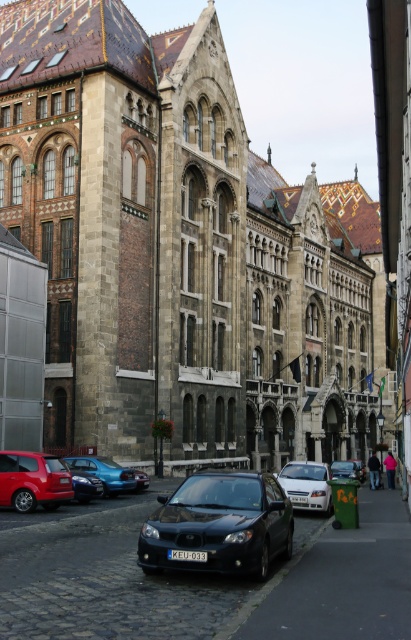
Consider the image. You are a delivery person who needs to park a 14 meter long truck between the shiny black sedan at center and the metallic blue sedan at center. Can the truck fit in the space between them?

The shiny black sedan at center is 13.76 meters from the metallic blue sedan at center. Since the truck is 14 meters long, it cannot fit between them as the distance is shorter than the truck.

You are standing on the cobblestone street in front of the Gothic building. You notice two points marked on the ground. The first point is at coordinates point (x=226, y=376) and the second is at point (x=90, y=496). Which point is closer to you?

Point (x=90, y=496) is closer to you because it is less further away than point (x=226, y=376).